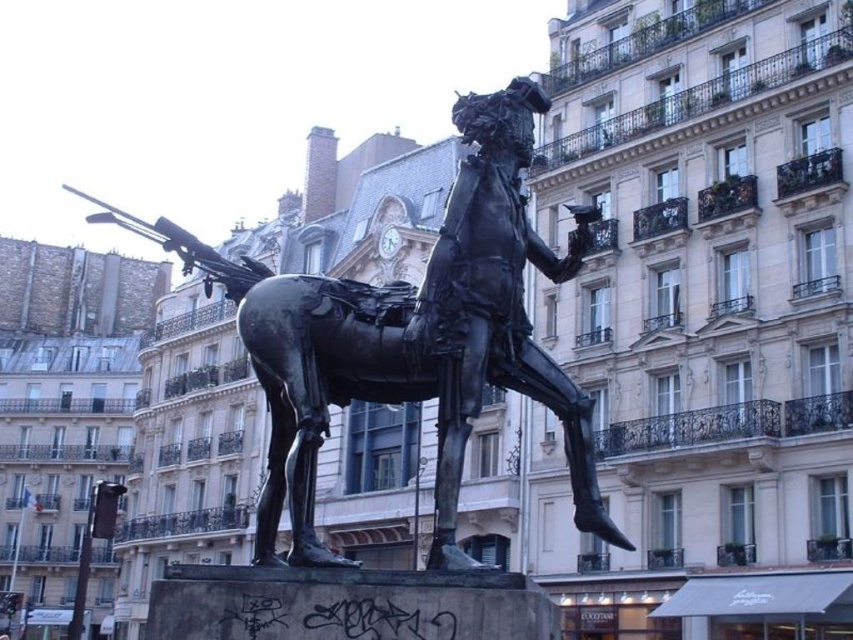
Question: Which object is closer to the camera taking this photo?

Choices:
 (A) polished metal gun at upper left
 (B) bronze statue at center

Answer: (B)

Question: Which point is closer to the camera taking this photo?

Choices:
 (A) (85, 218)
 (B) (392, 330)

Answer: (B)

Question: Does bronze statue at center have a lesser width compared to polished metal gun at upper left?

Choices:
 (A) yes
 (B) no

Answer: (B)

Question: Is bronze statue at center in front of polished metal gun at upper left?

Choices:
 (A) yes
 (B) no

Answer: (A)

Question: Is bronze statue at center further to camera compared to polished metal gun at upper left?

Choices:
 (A) yes
 (B) no

Answer: (B)

Question: Which object appears farthest from the camera in this image?

Choices:
 (A) bronze statue at center
 (B) polished metal gun at upper left

Answer: (B)